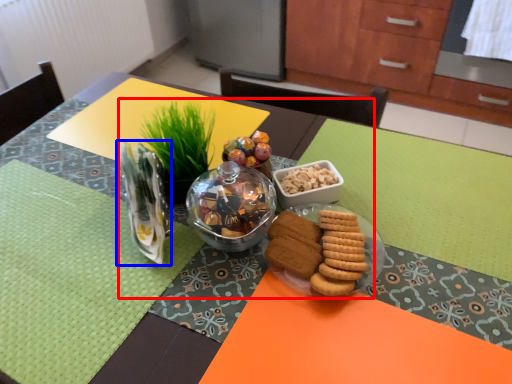
Question: Which object is further to the camera taking this photo, meal (highlighted by a red box) or tableware (highlighted by a blue box)?

Choices:
 (A) meal
 (B) tableware

Answer: (A)